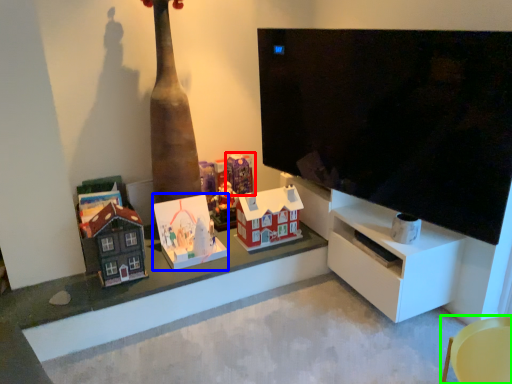
Question: Considering the real-world distances, which object is farthest from toy (highlighted by a red box)? toy (highlighted by a blue box) or furniture (highlighted by a green box)?

Choices:
 (A) toy
 (B) furniture

Answer: (B)